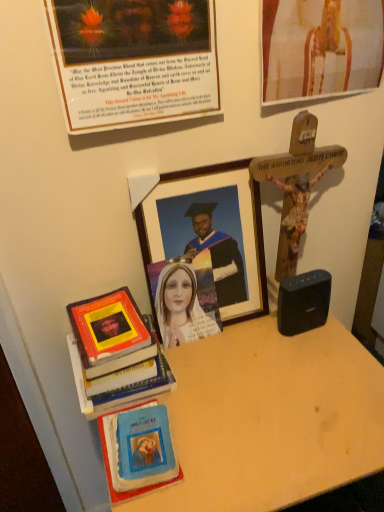
Image resolution: width=384 pixels, height=512 pixels. I want to click on unoccupied region to the right of hardcover book at left, which appears as the second book when ordered from the bottom, so click(x=213, y=378).